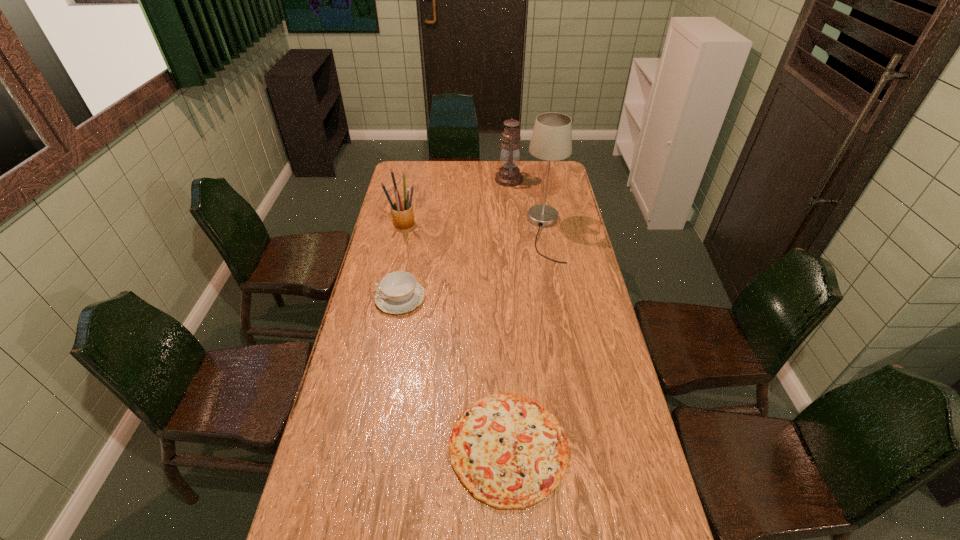
The height and width of the screenshot is (540, 960). Find the location of `free spot between the table lamp and the fourth farthest object`. free spot between the table lamp and the fourth farthest object is located at coordinates (472, 266).

Where is `vacant space in between the table lamp and the third tallest object`? Image resolution: width=960 pixels, height=540 pixels. vacant space in between the table lamp and the third tallest object is located at coordinates (474, 228).

Find the location of `free space between the table lamp and the pizza`. free space between the table lamp and the pizza is located at coordinates (527, 340).

At what (x,y) coordinates should I click in order to perform the action: click on unoccupied area between the fourth shortest object and the table lamp. Please return your answer as a coordinate pair (x, y). The height and width of the screenshot is (540, 960). Looking at the image, I should click on (527, 206).

The height and width of the screenshot is (540, 960). I want to click on vacant space that's between the shortest object and the fourth farthest object, so click(454, 372).

This screenshot has height=540, width=960. I want to click on free space between the tallest object and the fourth tallest object, so click(472, 266).

Find the location of a particular element. The image size is (960, 540). free space between the chinaware and the oil lamp is located at coordinates (455, 239).

Where is `free space between the chinaware and the pencil box`? This screenshot has height=540, width=960. free space between the chinaware and the pencil box is located at coordinates (402, 260).

Locate an element on the screen. The height and width of the screenshot is (540, 960). vacant space in between the pizza and the fourth shortest object is located at coordinates 509,313.

You are a GUI agent. You are given a task and a screenshot of the screen. Output one action in this format:
    pyautogui.click(x=<x>, y=<y>)
    Task: Click on the free area in between the pencil box and the fourth shortest object
    This screenshot has height=540, width=960.
    Given the screenshot: What is the action you would take?
    pyautogui.click(x=456, y=201)